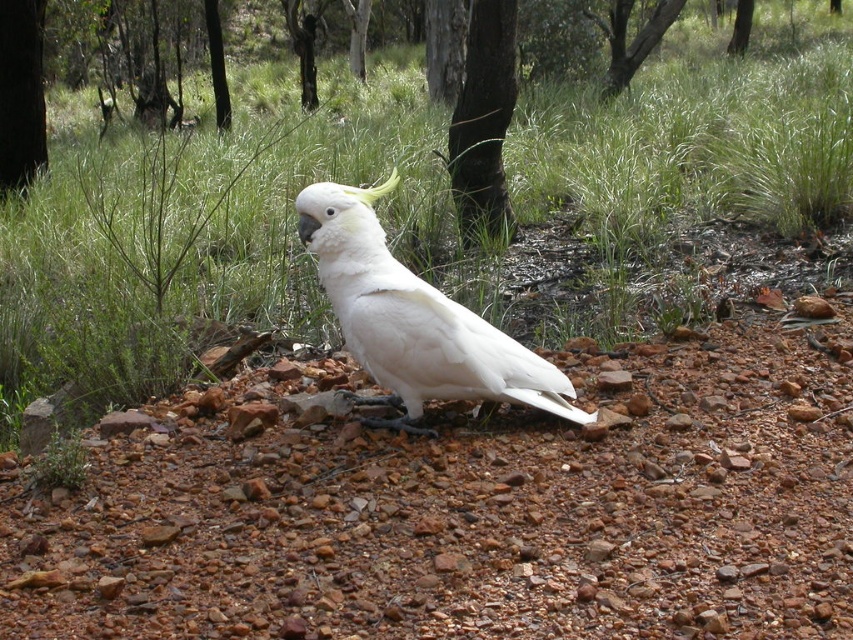
You are a hiker who has spotted a white cockatoo on the gravelly ground. You notice a point marked at coordinates [483,122]. What is located at that point?

The point at coordinates [483,122] indicates a smooth bark tree at center.

You are a birdwatcher observing the white cockatoo on the gravelly ground. You notice two green trees at the upper center of the image. Which tree is closer to the ground, the green leafy tree at upper center or the green smooth tree at upper center?

The green leafy tree at upper center is positioned under the green smooth tree at upper center, so the green leafy tree at upper center is closer to the ground.